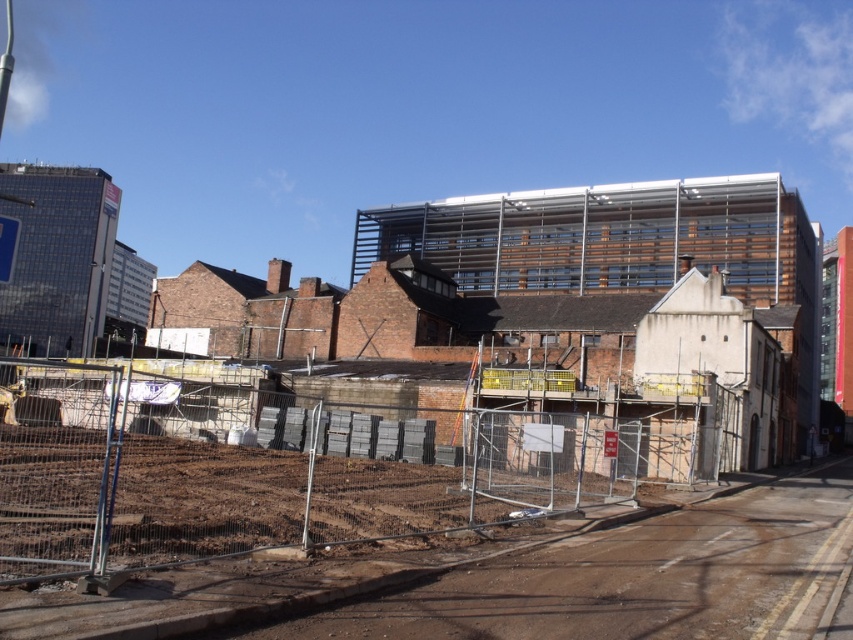
Can you confirm if metal scaffolding at center is wider than brown dirt track at lower left?

Correct, the width of metal scaffolding at center exceeds that of brown dirt track at lower left.

Which is above, metal scaffolding at center or brown dirt track at lower left?

metal scaffolding at center

Is point (310, 444) more distant than point (718, 532)?

Yes, it is behind point (718, 532).

In order to click on metal scaffolding at center in this screenshot , I will do `click(265, 468)`.